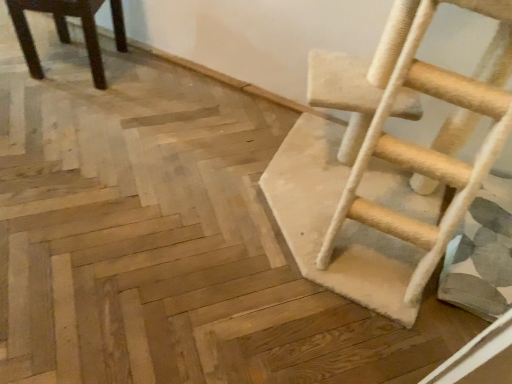
Find the location of a particular element. The image size is (512, 384). vacant area that lies between dark brown wood chair at upper left and beige carpeted ladder at right is located at coordinates (176, 128).